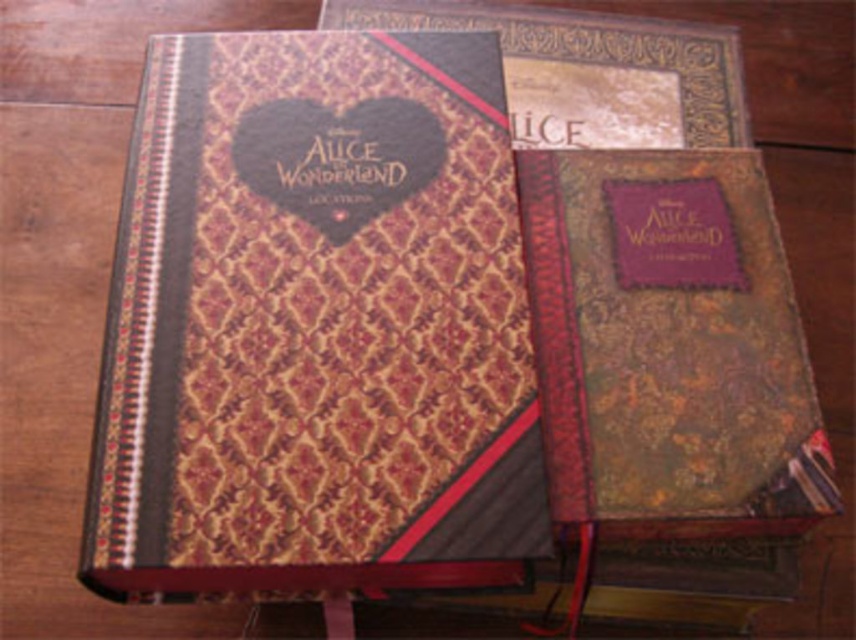
Question: Does gold-patterned leather journal at center appear on the right side of gold textured book at upper center?

Choices:
 (A) no
 (B) yes

Answer: (A)

Question: Can you confirm if gold-patterned leather journal at center is thinner than gold textured book at upper center?

Choices:
 (A) no
 (B) yes

Answer: (B)

Question: Which object is farther from the camera taking this photo?

Choices:
 (A) gold-patterned leather journal at center
 (B) gold textured journal at center

Answer: (B)

Question: Which of these objects is positioned farthest from the gold textured book at upper center?

Choices:
 (A) gold-patterned leather journal at center
 (B) gold textured journal at center

Answer: (A)

Question: Is gold textured journal at center below gold textured book at upper center?

Choices:
 (A) no
 (B) yes

Answer: (B)

Question: Which of these objects is positioned closest to the gold textured book at upper center?

Choices:
 (A) gold-patterned leather journal at center
 (B) gold textured journal at center

Answer: (B)